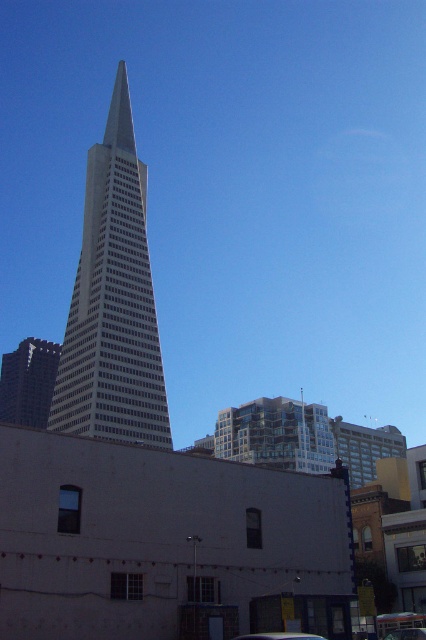
Who is positioned more to the left, metallic silver car at lower center or metallic silver car at center?

Positioned to the left is metallic silver car at lower center.

This screenshot has width=426, height=640. Describe the element at coordinates (279, 636) in the screenshot. I see `metallic silver car at lower center` at that location.

Where is `metallic silver car at lower center`? Image resolution: width=426 pixels, height=640 pixels. metallic silver car at lower center is located at coordinates (279, 636).

Is glassy steel skyscraper at center below metallic silver car at center?

No, glassy steel skyscraper at center is not below metallic silver car at center.

At what (x,y) coordinates should I click in order to perform the action: click on glassy steel skyscraper at center. Please return your answer as a coordinate pair (x, y). Looking at the image, I should click on (112, 301).

This screenshot has height=640, width=426. Identify the location of glassy steel skyscraper at center. (112, 301).

Does glassy steel skyscraper at center have a lesser height compared to metallic silver car at lower center?

No.

Who is shorter, glassy steel skyscraper at center or metallic silver car at lower center?

metallic silver car at lower center

Between point (129, 246) and point (262, 637), which one is positioned in front?

Point (262, 637)

Locate an element on the screen. glassy steel skyscraper at center is located at coordinates (112, 301).